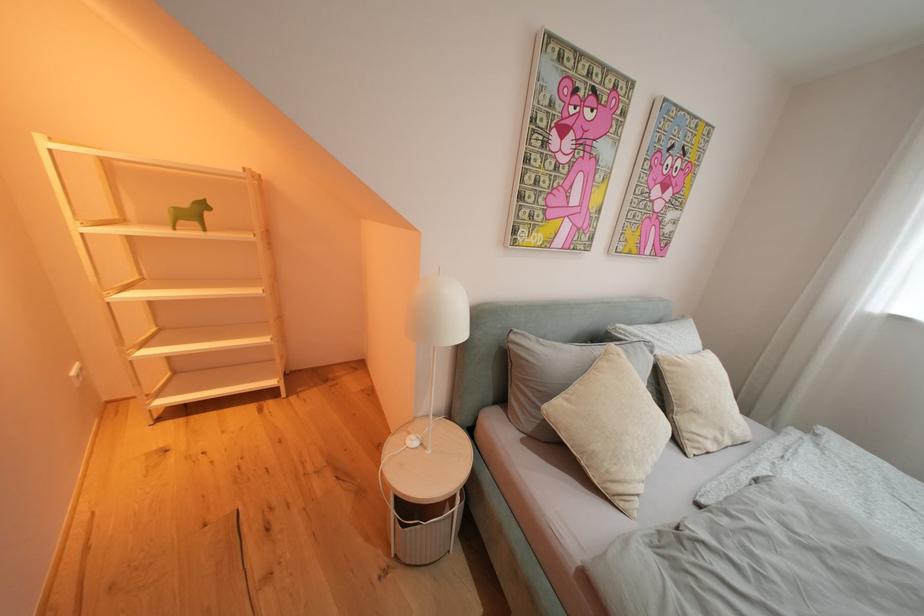
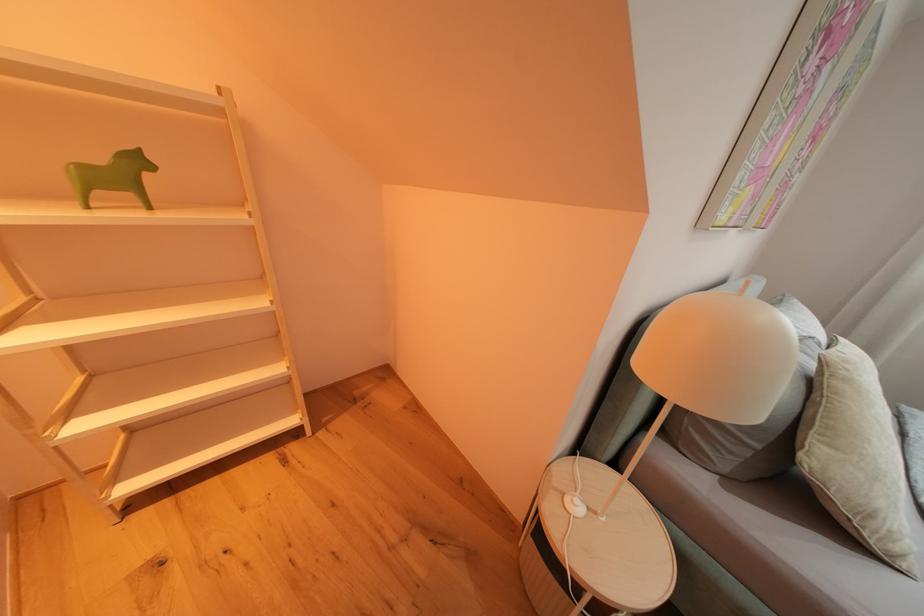
Consider the image. Which direction would the cameraman need to move to produce the second image?

The movement direction of the cameraman is left, forward.